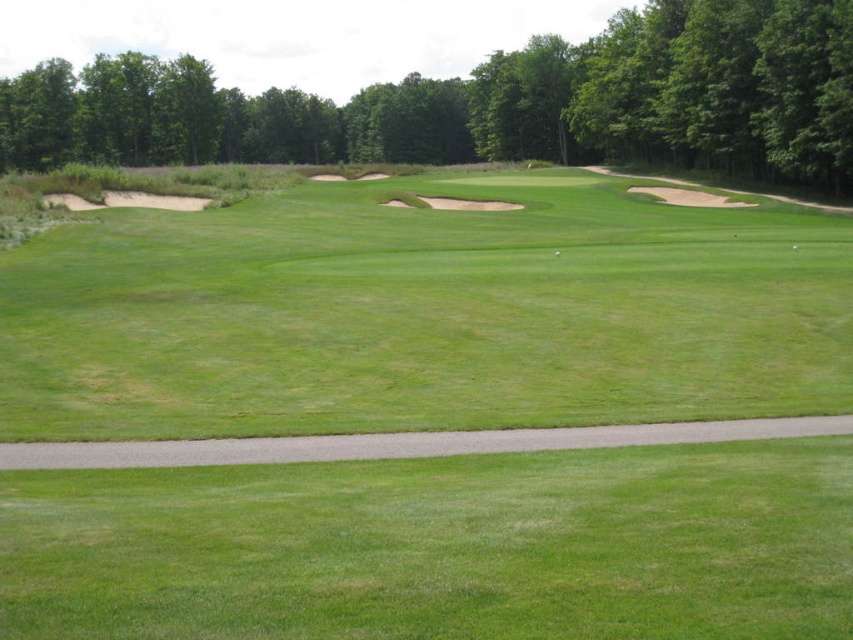
Question: Does green grassy fairway at center appear under white matte golf ball at center?

Choices:
 (A) yes
 (B) no

Answer: (A)

Question: Estimate the real-world distances between objects in this image. Which object is closer to the green leafy tree at upper center?

Choices:
 (A) white matte golf ball at center
 (B) green grassy fairway at center

Answer: (B)

Question: Considering the real-world distances, which object is closest to the green grassy fairway at center?

Choices:
 (A) white matte golf ball at center
 (B) green leafy tree at upper center

Answer: (A)

Question: Among these points, which one is nearest to the camera?

Choices:
 (A) (553, 252)
 (B) (531, 198)
 (C) (293, 136)

Answer: (A)

Question: In this image, where is green grassy fairway at center located relative to green leafy tree at upper center?

Choices:
 (A) right
 (B) left

Answer: (A)

Question: Considering the relative positions of green grassy fairway at center and white matte golf ball at center in the image provided, where is green grassy fairway at center located with respect to white matte golf ball at center?

Choices:
 (A) above
 (B) below

Answer: (B)